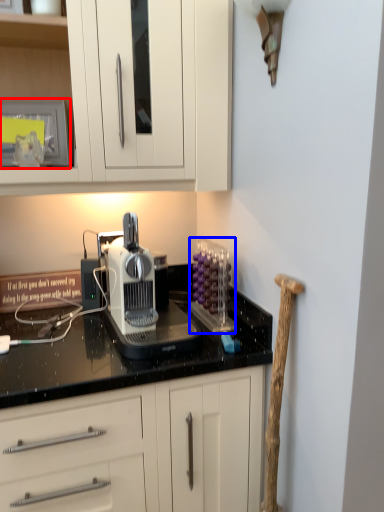
Question: Which of the following is the farthest to the observer, appliance (highlighted by a red box) or kitchen appliance (highlighted by a blue box)?

Choices:
 (A) appliance
 (B) kitchen appliance

Answer: (A)